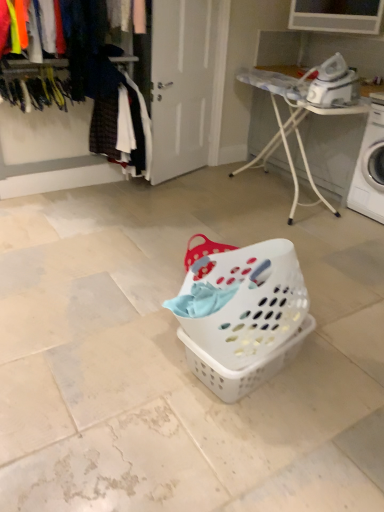
Question: Can you confirm if white plastic washing machine at right is smaller than white plastic ironing board at upper right?

Choices:
 (A) no
 (B) yes

Answer: (B)

Question: Is white plastic washing machine at right bigger than white plastic ironing board at upper right?

Choices:
 (A) yes
 (B) no

Answer: (B)

Question: Is the depth of white plastic washing machine at right greater than that of white plastic ironing board at upper right?

Choices:
 (A) yes
 (B) no

Answer: (B)

Question: Is the position of white plastic washing machine at right less distant than that of white plastic ironing board at upper right?

Choices:
 (A) no
 (B) yes

Answer: (B)

Question: Is white plastic washing machine at right at the right side of white plastic ironing board at upper right?

Choices:
 (A) no
 (B) yes

Answer: (B)

Question: Would you say white plastic ironing board at upper right is to the left or to the right of white plastic washing machine at right in the picture?

Choices:
 (A) left
 (B) right

Answer: (A)

Question: From a real-world perspective, relative to white plastic washing machine at right, is white plastic ironing board at upper right vertically above or below?

Choices:
 (A) above
 (B) below

Answer: (A)

Question: Looking at their shapes, would you say white plastic ironing board at upper right is wider or thinner than white plastic washing machine at right?

Choices:
 (A) wide
 (B) thin

Answer: (B)

Question: In terms of height, does white plastic ironing board at upper right look taller or shorter compared to white plastic washing machine at right?

Choices:
 (A) tall
 (B) short

Answer: (A)

Question: Based on their sizes in the image, would you say white plastic iron at upper right is bigger or smaller than matte plastic clothes at upper left?

Choices:
 (A) small
 (B) big

Answer: (A)

Question: Is white plastic iron at upper right to the left or to the right of matte plastic clothes at upper left in the image?

Choices:
 (A) left
 (B) right

Answer: (B)

Question: From a real-world perspective, is white plastic iron at upper right above or below matte plastic clothes at upper left?

Choices:
 (A) below
 (B) above

Answer: (B)

Question: In terms of width, does white plastic iron at upper right look wider or thinner when compared to matte plastic clothes at upper left?

Choices:
 (A) thin
 (B) wide

Answer: (B)

Question: From a real-world perspective, relative to white plastic iron at upper right, is velvet-like fabric at upper left vertically above or below?

Choices:
 (A) above
 (B) below

Answer: (B)

Question: Considering the positions of velvet-like fabric at upper left and white plastic iron at upper right in the image, is velvet-like fabric at upper left bigger or smaller than white plastic iron at upper right?

Choices:
 (A) small
 (B) big

Answer: (B)